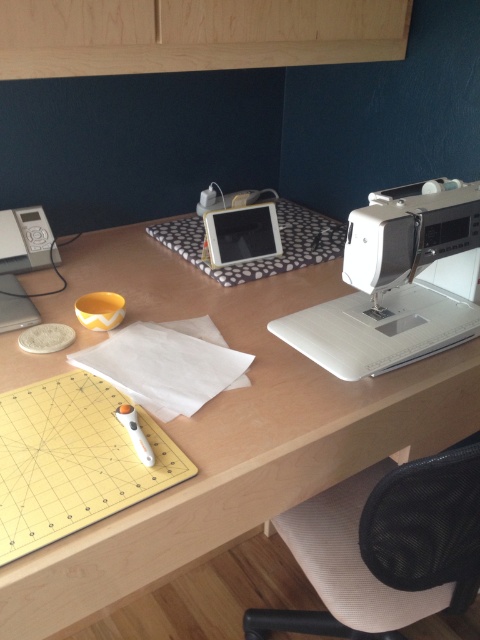
Is point (326, 269) behind point (446, 340)?

Yes.

Between wooden computer desk at center and white plastic sewing machine at right, which one has less height?

white plastic sewing machine at right

You are a GUI agent. You are given a task and a screenshot of the screen. Output one action in this format:
    pyautogui.click(x=<x>, y=<y>)
    Task: Click on the wooden computer desk at center
    This screenshot has width=480, height=640.
    Given the screenshot: What is the action you would take?
    pyautogui.click(x=222, y=428)